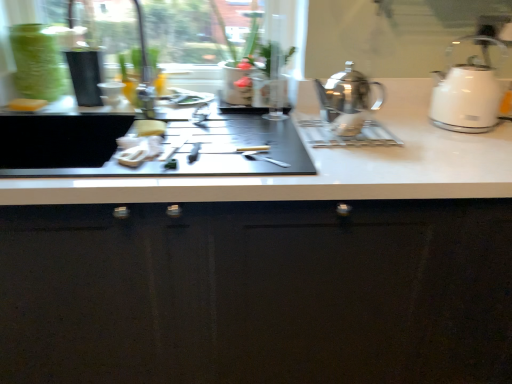
I want to click on free spot to the right of white fabric napkin at center, marked as the 1th food in a bottom-to-top arrangement, so tap(218, 148).